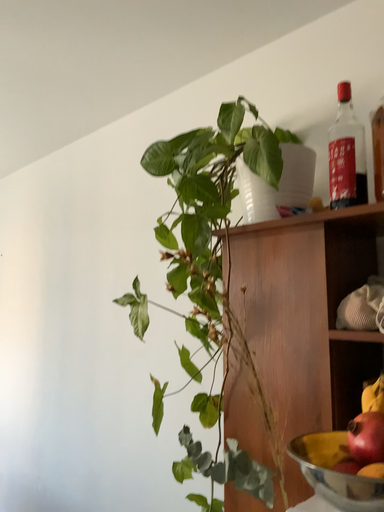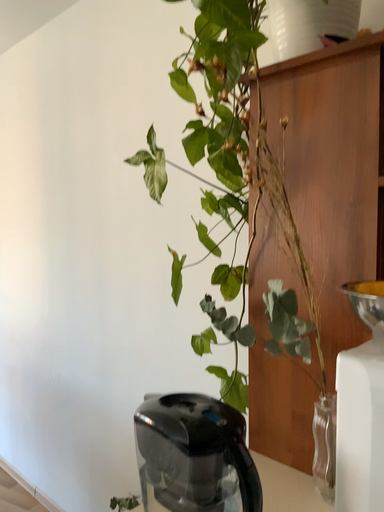
Question: How did the camera likely rotate when shooting the video?

Choices:
 (A) rotated downward
 (B) rotated upward

Answer: (A)